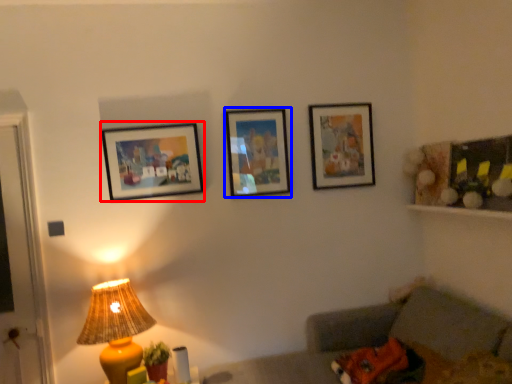
Question: Among these objects, which one is farthest to the camera, picture frame (highlighted by a red box) or picture frame (highlighted by a blue box)?

Choices:
 (A) picture frame
 (B) picture frame

Answer: (B)